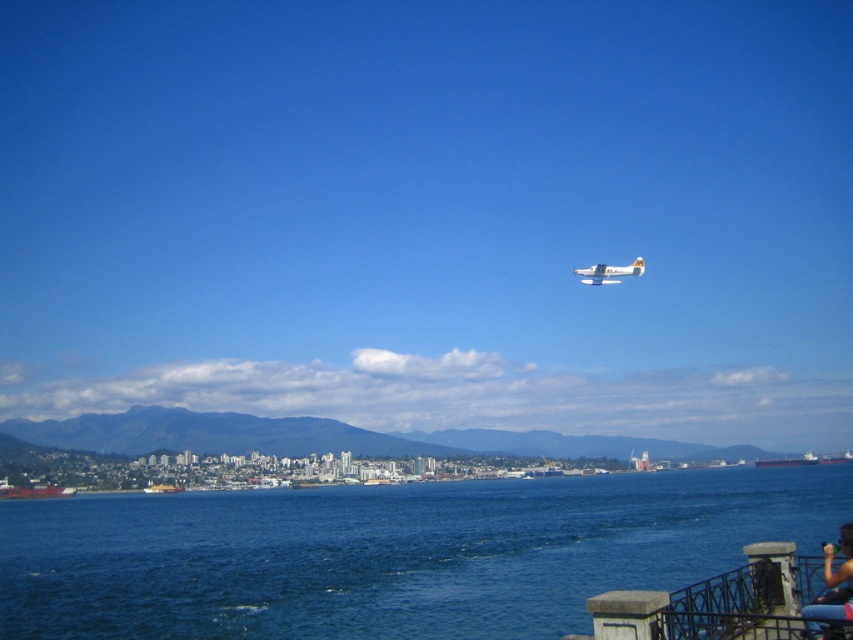
Question: Which of the following is the closest to the observer?

Choices:
 (A) (605, 264)
 (B) (268, 573)
 (C) (762, 570)
 (D) (842, 528)

Answer: (C)

Question: Is blue water at lower center wider than black metal railing at lower right?

Choices:
 (A) no
 (B) yes

Answer: (B)

Question: Observing the image, what is the correct spatial positioning of black metal railing at lower right in reference to blue denim jeans at lower right?

Choices:
 (A) left
 (B) right

Answer: (A)

Question: Which point is closer to the camera?

Choices:
 (A) blue denim jeans at lower right
 (B) blue water at lower center
 (C) black metal railing at lower right

Answer: (C)

Question: Which object is the closest to the black metal railing at lower right?

Choices:
 (A) white matte airplane at upper center
 (B) blue denim jeans at lower right

Answer: (B)

Question: Is blue water at lower center bigger than white matte airplane at upper center?

Choices:
 (A) yes
 (B) no

Answer: (A)